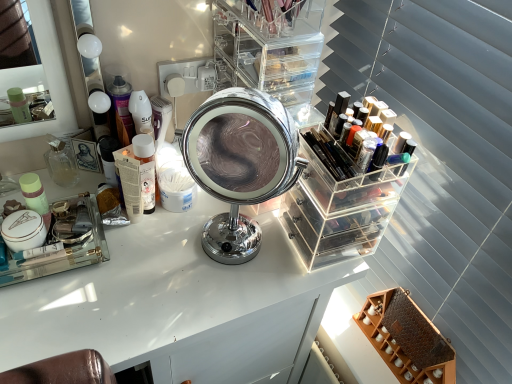
Identify the location of blank space to the left of chrome/metallic mirror at center. (147, 253).